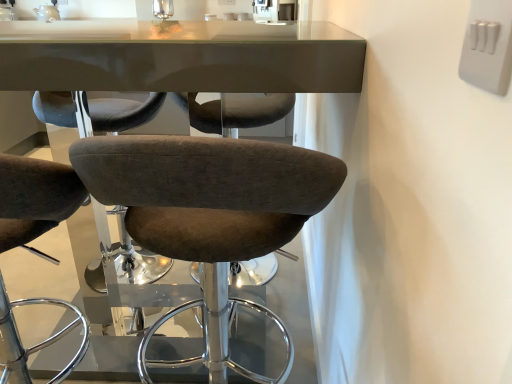
Question: Considering the relative sizes of white plastic switch at upper right and white glossy sink at upper center in the image provided, is white plastic switch at upper right taller than white glossy sink at upper center?

Choices:
 (A) yes
 (B) no

Answer: (B)

Question: From a real-world perspective, is white plastic switch at upper right beneath white glossy sink at upper center?

Choices:
 (A) no
 (B) yes

Answer: (A)

Question: Is white plastic switch at upper right further to camera compared to white glossy sink at upper center?

Choices:
 (A) no
 (B) yes

Answer: (A)

Question: From the image's perspective, is white plastic switch at upper right located above white glossy sink at upper center?

Choices:
 (A) yes
 (B) no

Answer: (B)

Question: Can you confirm if white plastic switch at upper right is positioned to the right of white glossy sink at upper center?

Choices:
 (A) no
 (B) yes

Answer: (B)

Question: Is white plastic switch at upper right turned away from white glossy sink at upper center?

Choices:
 (A) no
 (B) yes

Answer: (A)

Question: Considering the relative sizes of white glossy sink at upper center and white plastic switch at upper right in the image provided, is white glossy sink at upper center thinner than white plastic switch at upper right?

Choices:
 (A) no
 (B) yes

Answer: (A)

Question: Is white glossy sink at upper center outside of white plastic switch at upper right?

Choices:
 (A) yes
 (B) no

Answer: (A)

Question: From the image's perspective, is white glossy sink at upper center on white plastic switch at upper right?

Choices:
 (A) yes
 (B) no

Answer: (A)

Question: Is white glossy sink at upper center wider than white plastic switch at upper right?

Choices:
 (A) no
 (B) yes

Answer: (B)

Question: Is the depth of white glossy sink at upper center less than that of white plastic switch at upper right?

Choices:
 (A) yes
 (B) no

Answer: (B)

Question: Is white glossy sink at upper center to the left of white plastic switch at upper right from the viewer's perspective?

Choices:
 (A) no
 (B) yes

Answer: (B)

Question: Does white glossy sink at upper center have a smaller size compared to brown fabric stool at center?

Choices:
 (A) no
 (B) yes

Answer: (B)